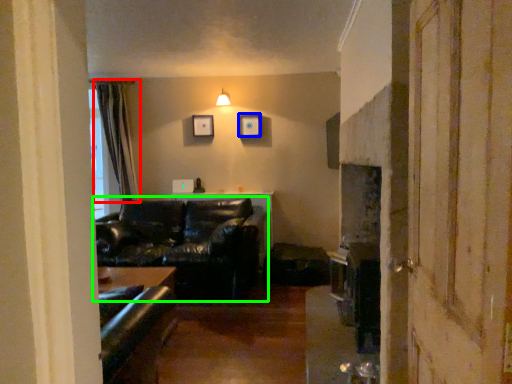
Question: Considering the real-world distances, which object is farthest from curtain (highlighted by a red box)? picture frame (highlighted by a blue box) or studio couch (highlighted by a green box)?

Choices:
 (A) picture frame
 (B) studio couch

Answer: (A)